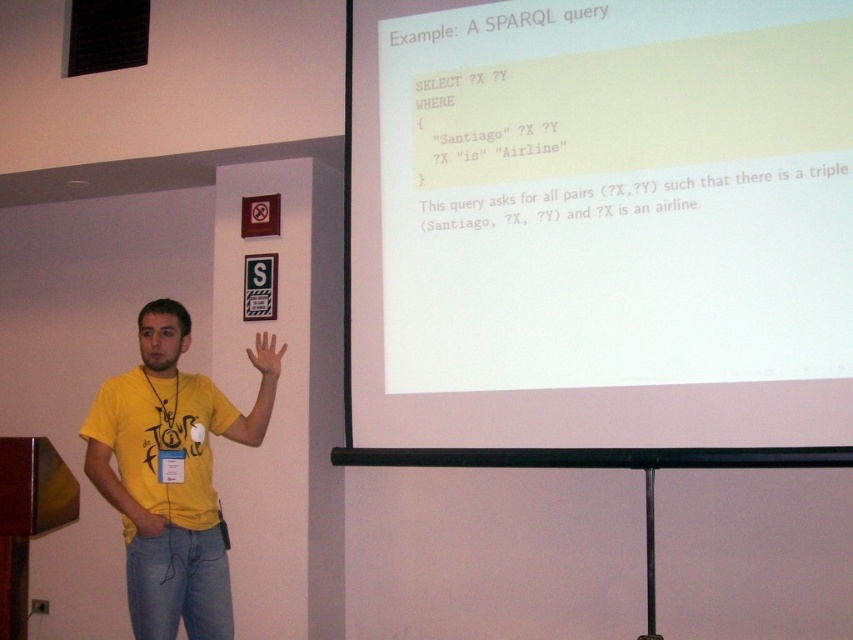
You are a presenter standing in front of the screen. You want to point to both the matte yellow hand at center and the yellow matte hand at lower left using your laser pointer. Can you reach both targets with the laser pointer if its maximum range is 30 inches?

The distance between the matte yellow hand at center and the yellow matte hand at lower left is 29.13 inches, which is within the laser pointer range of 30 inches. Therefore, you can reach both targets with the laser pointer.

You are an assistant in a classroom. You see a white paper at upper center and a matte yellow hand at center. Which object is wider?

The white paper at upper center might be wider than the matte yellow hand at center, so the white paper at upper center is possibly wider.

Based on the scene description, which object is taller, the white paper at upper center or the yellow matte hand at lower left?

The white paper at upper center is much taller than the yellow matte hand at lower left according to the description.